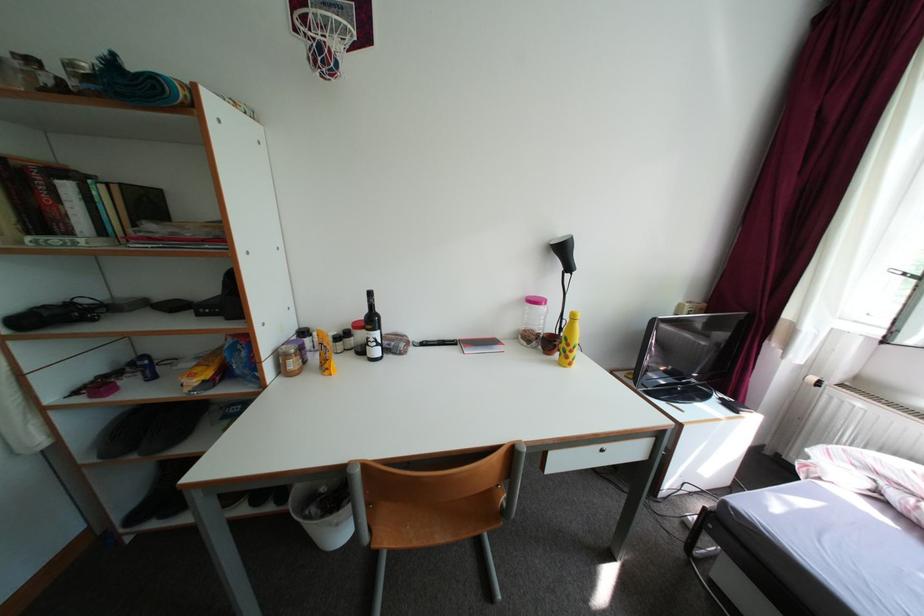
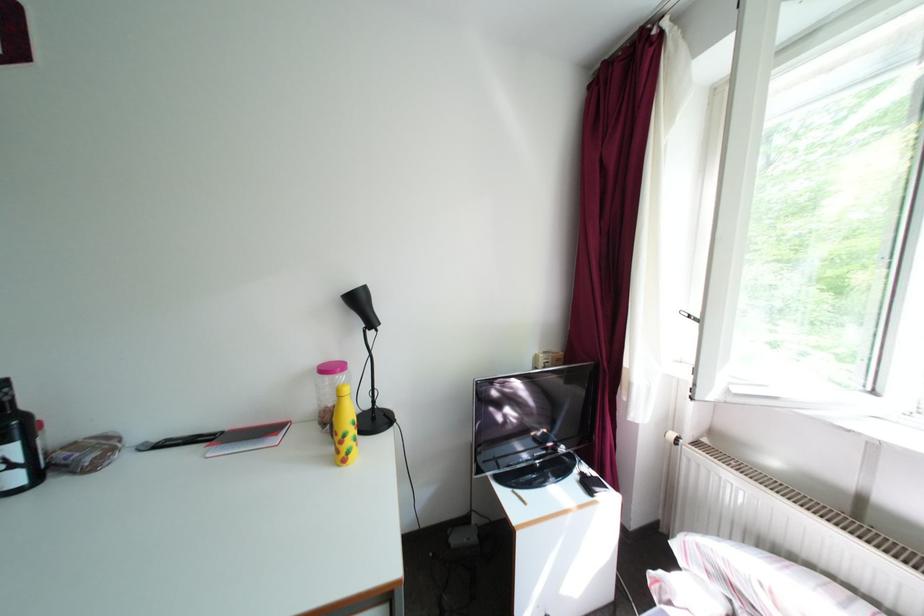
Question: The first image is from the beginning of the video and the second image is from the end. How did the camera likely rotate when shooting the video?

Choices:
 (A) Left
 (B) Right
 (C) Up
 (D) Down

Answer: (C)